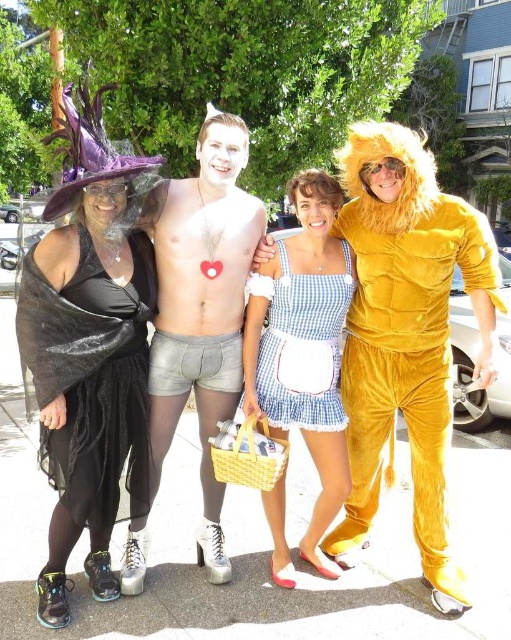
You are standing in the outdoor scene and want to find the velvet yellow lion at right. Based on the coordinates provided in the Objects Description, can you determine its position relative to the other objects in the scene?

The velvet yellow lion at right is located at point (406, 336), which places it towards the lower right quadrant of the scene, making it easy to locate from the other objects.